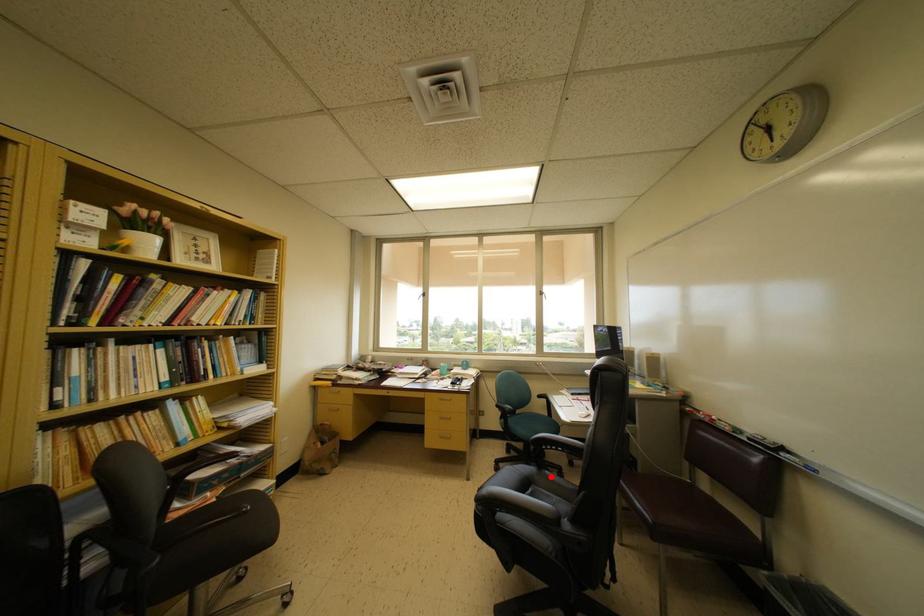
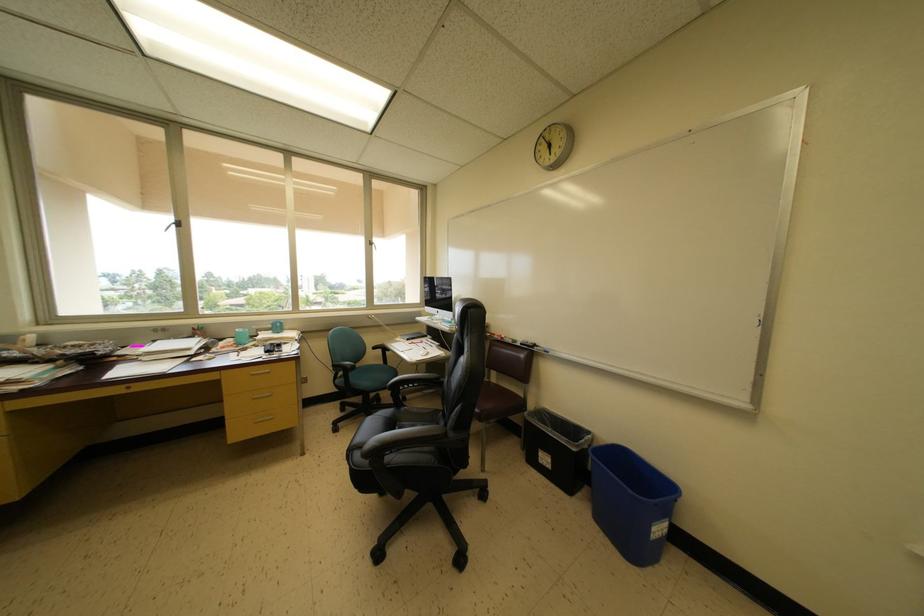
Question: I am providing you with two images of the same scene from different viewpoints. In image1, a red point is highlighted. Considering the same 3D point in image2, which of the following is correct?

Choices:
 (A) It is closer
 (B) It is farther

Answer: (B)